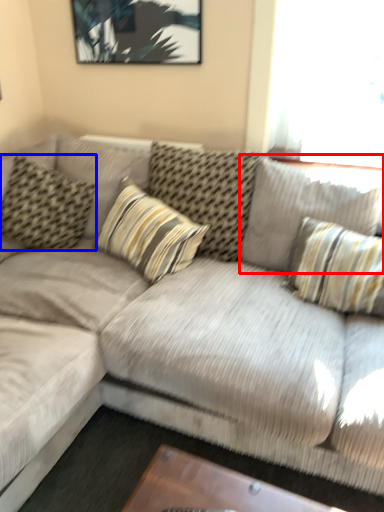
Question: Which point is closer to the camera, pillow (highlighted by a red box) or pillow (highlighted by a blue box)?

Choices:
 (A) pillow
 (B) pillow

Answer: (A)